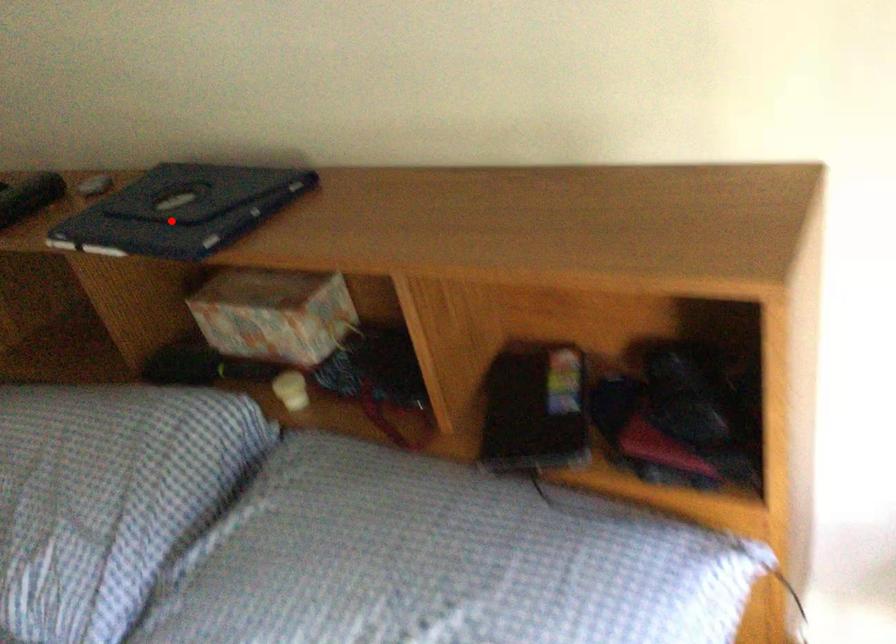
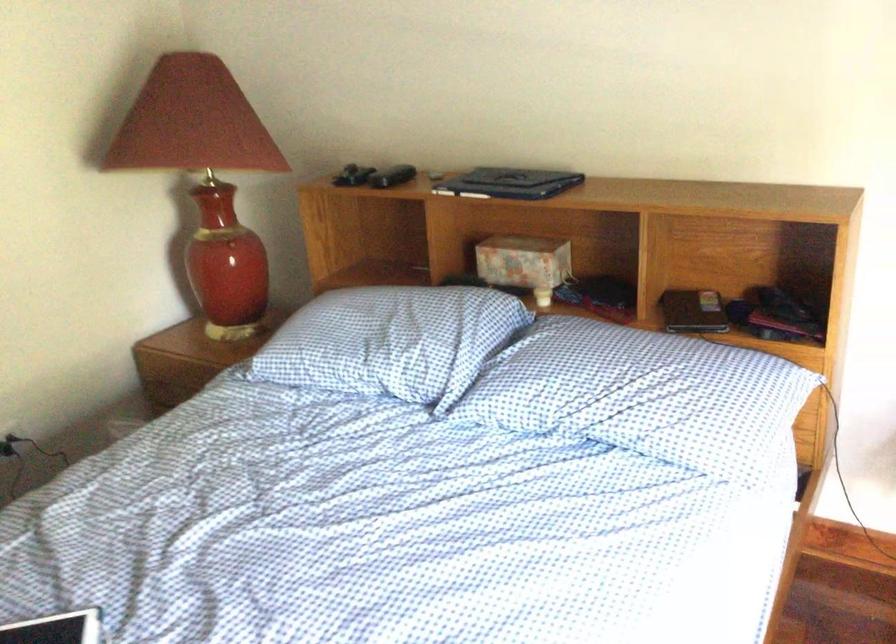
Question: I am providing you with two images of the same scene from different viewpoints. Image1 has a red point marked. In image2, the corresponding 3D location appears at what relative position? Reply with the corresponding letter.

Choices:
 (A) Closer
 (B) Farther

Answer: (B)